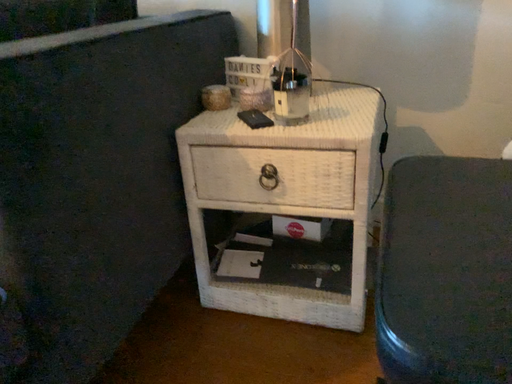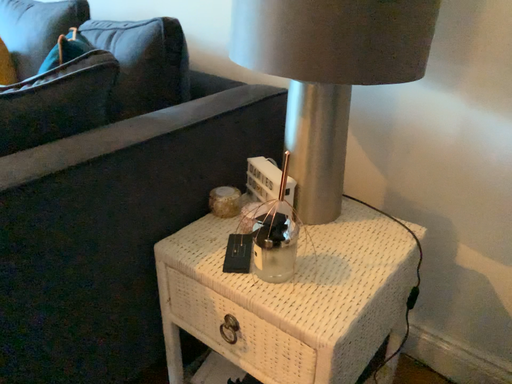
Question: How did the camera likely rotate when shooting the video?

Choices:
 (A) rotated right
 (B) rotated left

Answer: (B)